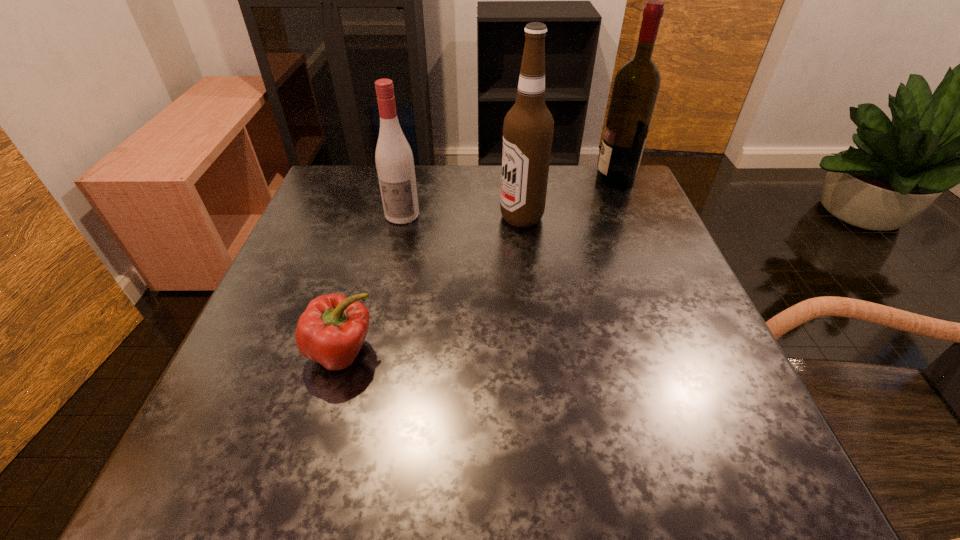
Locate an element on the screen. Image resolution: width=960 pixels, height=540 pixels. vacant space located on the front and back of the farthest object is located at coordinates (527, 180).

What are the coordinates of `vacant position located on the front and back of the farthest object` in the screenshot? It's located at (458, 180).

This screenshot has height=540, width=960. In order to click on vacant space located 0.240m on the front and back of the farthest object in this screenshot , I will do `click(504, 180)`.

Find the location of a particular element. blank area located 0.190m on the label of the shortest alcohol is located at coordinates tap(387, 282).

Where is `vacant space located 0.340m on the right of the bell pepper`? The width and height of the screenshot is (960, 540). vacant space located 0.340m on the right of the bell pepper is located at coordinates (577, 352).

At what (x,y) coordinates should I click in order to perform the action: click on object that is at the left edge. Please return your answer as a coordinate pair (x, y). This screenshot has height=540, width=960. Looking at the image, I should click on (331, 331).

This screenshot has width=960, height=540. In order to click on object that is positioned at the right edge in this screenshot , I will do `click(636, 86)`.

Where is `object located in the far right corner section of the desktop`? This screenshot has height=540, width=960. object located in the far right corner section of the desktop is located at coordinates (636, 86).

Identify the location of blank space at the far edge of the desktop. (558, 212).

Where is `free region at the near edge of the desktop`? The width and height of the screenshot is (960, 540). free region at the near edge of the desktop is located at coordinates (406, 487).